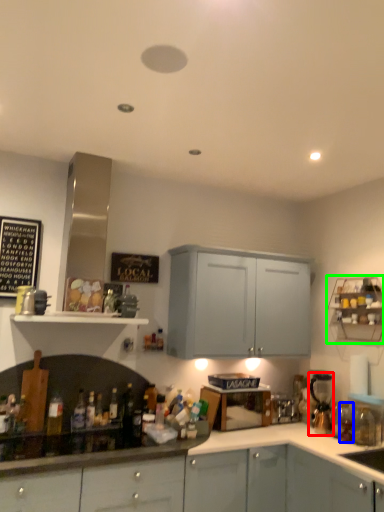
Question: Based on their relative distances, which object is farther from coffee machine (highlighted by a red box)? Choose from bottle (highlighted by a blue box) and shelf (highlighted by a green box).

Choices:
 (A) bottle
 (B) shelf

Answer: (B)